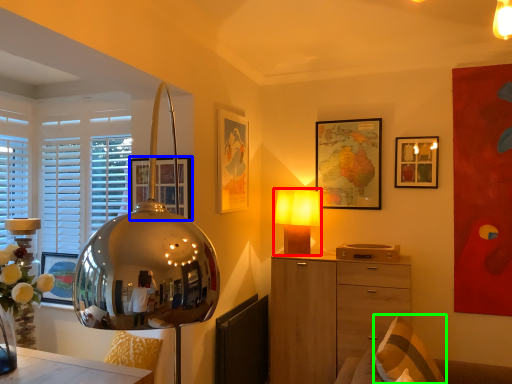
Question: Based on their relative distances, which object is farther from lamp (highlighted by a red box)? Choose from picture frame (highlighted by a blue box) and pillow (highlighted by a green box).

Choices:
 (A) picture frame
 (B) pillow

Answer: (B)